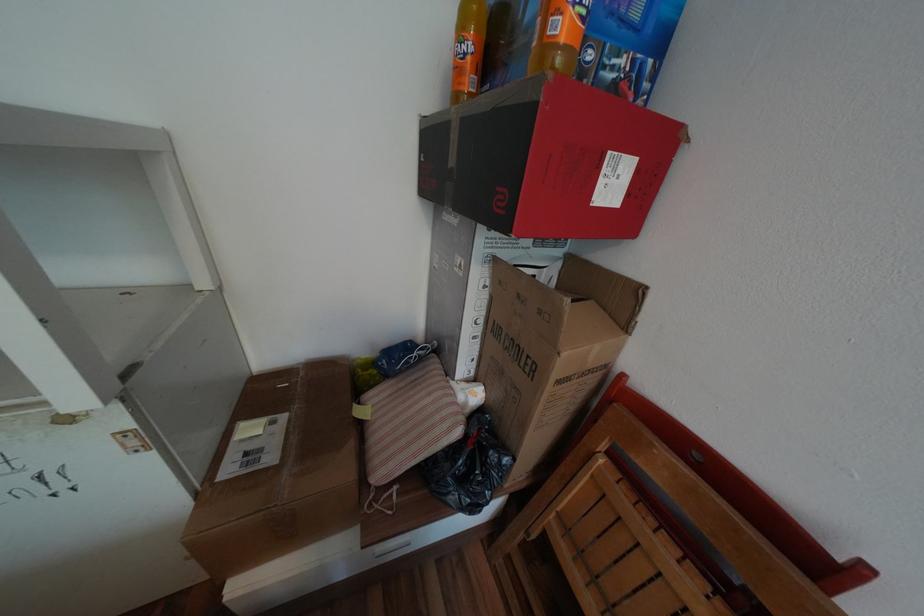
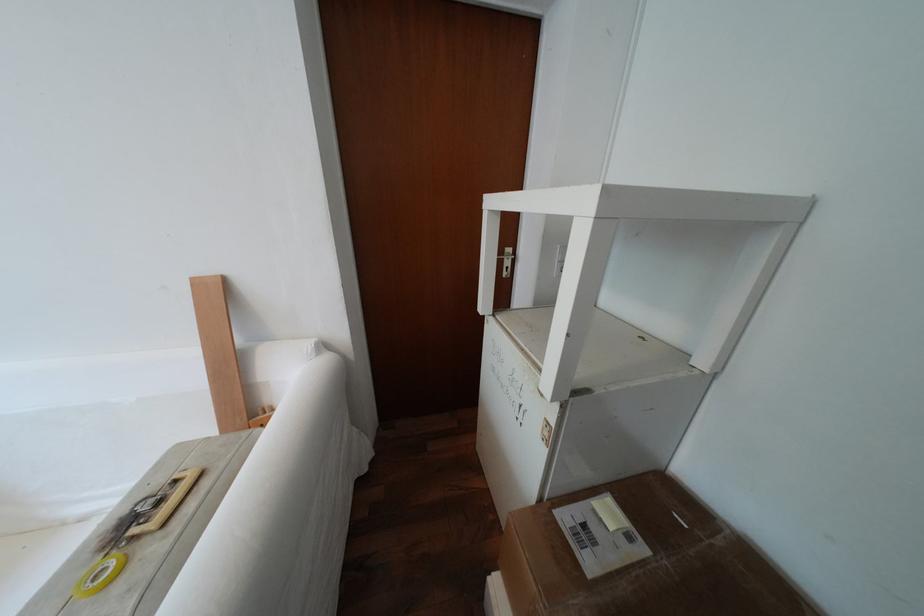
In the scene shown: First-person continuous shooting, in which direction is the camera rotating?

The camera's rotation is toward left-down.